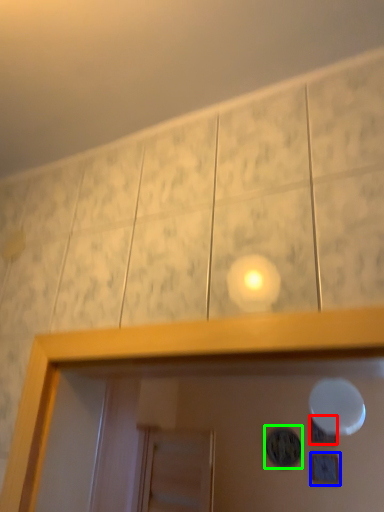
Question: Which object is positioned closest to dot (highlighted by a red box)? Select from picture frame (highlighted by a blue box) and dot (highlighted by a green box).

Choices:
 (A) picture frame
 (B) dot

Answer: (A)